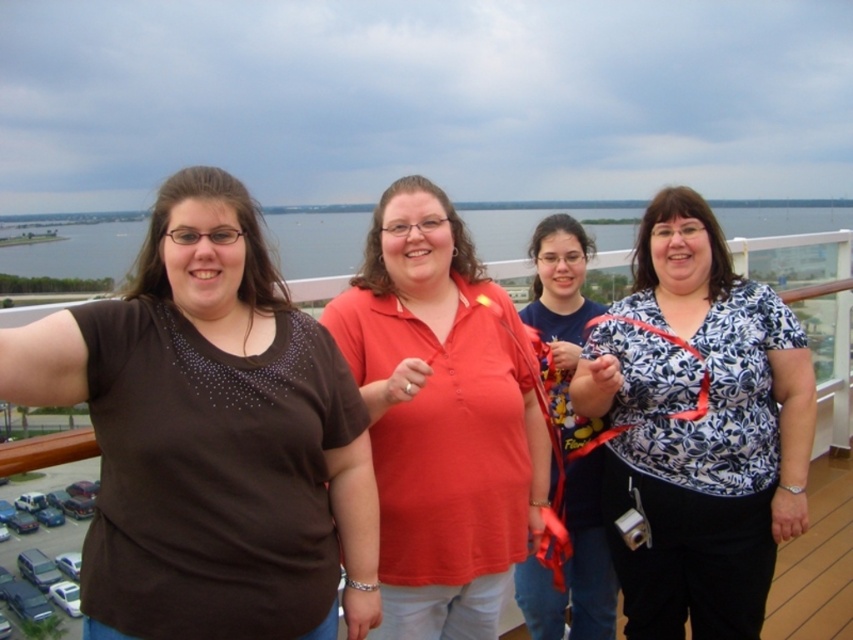
Consider the image. Based on the scene description, where is the matte brown shirt at left located in the image?

The matte brown shirt at left is located at point 0.683 on the x axis and 0.247 on the y axis.

You are a photographer trying to capture a group photo of the matte red polo shirt at center and the white floral blouse at right. Based on their positions, which person should you focus on first to ensure they are in sharp focus?

The matte red polo shirt at center should be focused on first because it is positioned above the white floral blouse at right, making it closer to the camera.